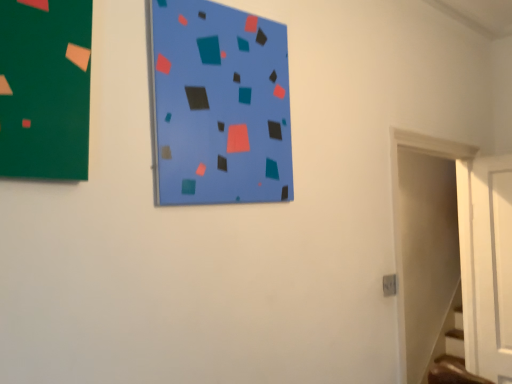
Measure the distance between white wooden door at right and camera.

The depth of white wooden door at right is 11.09 feet.

This screenshot has height=384, width=512. Describe the element at coordinates (425, 243) in the screenshot. I see `white wooden door at right` at that location.

Where is `white wooden door at right`? white wooden door at right is located at coordinates (425, 243).

Locate an element on the screen. blue matte bulletin board at center is located at coordinates (218, 105).

What is the approximate width of blue matte bulletin board at center?

It is 1.56 inches.

This screenshot has height=384, width=512. What do you see at coordinates (218, 105) in the screenshot?
I see `blue matte bulletin board at center` at bounding box center [218, 105].

Identify the location of white wooden door at right. (425, 243).

Can you confirm if white wooden door at right is positioned to the right of blue matte bulletin board at center?

Indeed, white wooden door at right is positioned on the right side of blue matte bulletin board at center.

Considering the relative positions of white wooden door at right and blue matte bulletin board at center in the image provided, is white wooden door at right in front of blue matte bulletin board at center?

No, white wooden door at right is further to the viewer.

Is point (410, 219) behind point (189, 152)?

Yes.

From the image's perspective, does white wooden door at right appear lower than blue matte bulletin board at center?

Indeed, from the image's perspective, white wooden door at right is shown beneath blue matte bulletin board at center.

From a real-world perspective, which object rests below the other?

white wooden door at right, from a real-world perspective.

Is white wooden door at right wider than blue matte bulletin board at center?

Indeed, white wooden door at right has a greater width compared to blue matte bulletin board at center.

In terms of height, does white wooden door at right look taller or shorter compared to blue matte bulletin board at center?

Clearly, white wooden door at right is taller compared to blue matte bulletin board at center.

Is white wooden door at right smaller than blue matte bulletin board at center?

No.

Is white wooden door at right inside the boundaries of blue matte bulletin board at center, or outside?

white wooden door at right is located beyond the bounds of blue matte bulletin board at center.

From the picture: Would you consider white wooden door at right to be distant from blue matte bulletin board at center?

Absolutely, white wooden door at right is distant from blue matte bulletin board at center.

Is white wooden door at right oriented towards blue matte bulletin board at center?

No, white wooden door at right is not facing towards blue matte bulletin board at center.

Can you tell me how much white wooden door at right and blue matte bulletin board at center differ in facing direction?

0.122 degrees.

You are a GUI agent. You are given a task and a screenshot of the screen. Output one action in this format:
    pyautogui.click(x=<x>, y=<y>)
    Task: Click on the door below the blue matte bulletin board at center (from the image's perspective)
    
    Given the screenshot: What is the action you would take?
    pyautogui.click(x=425, y=243)

Which is more to the right, blue matte bulletin board at center or white wooden door at right?

Positioned to the right is white wooden door at right.

In the image, is blue matte bulletin board at center positioned in front of or behind white wooden door at right?

Visually, blue matte bulletin board at center is located in front of white wooden door at right.

Does point (221, 190) appear closer or farther from the camera than point (454, 230)?

Clearly, point (221, 190) is closer to the camera than point (454, 230).

From the image's perspective, which is below, blue matte bulletin board at center or white wooden door at right?

white wooden door at right is shown below in the image.

From a real-world perspective, which is physically above, blue matte bulletin board at center or white wooden door at right?

In real-world perspective, blue matte bulletin board at center is above.

Considering the relative sizes of blue matte bulletin board at center and white wooden door at right in the image provided, is blue matte bulletin board at center wider than white wooden door at right?

No.

In the scene shown: Considering the sizes of blue matte bulletin board at center and white wooden door at right in the image, is blue matte bulletin board at center taller or shorter than white wooden door at right?

blue matte bulletin board at center is shorter than white wooden door at right.

Does blue matte bulletin board at center have a smaller size compared to white wooden door at right?

Correct, blue matte bulletin board at center occupies less space than white wooden door at right.

Could white wooden door at right be considered to be inside blue matte bulletin board at center?

No, white wooden door at right is located outside of blue matte bulletin board at center.

Would you consider blue matte bulletin board at center to be distant from white wooden door at right?

Yes, blue matte bulletin board at center and white wooden door at right are located far from each other.

Could you tell me if blue matte bulletin board at center is facing white wooden door at right?

No, blue matte bulletin board at center is not oriented towards white wooden door at right.

The width and height of the screenshot is (512, 384). Identify the location of door lying behind the blue matte bulletin board at center. (425, 243).

This screenshot has width=512, height=384. What are the coordinates of `bulletin board above the white wooden door at right (from the image's perspective)` in the screenshot? It's located at (218, 105).

Identify the location of door below the blue matte bulletin board at center (from the image's perspective). Image resolution: width=512 pixels, height=384 pixels. (425, 243).